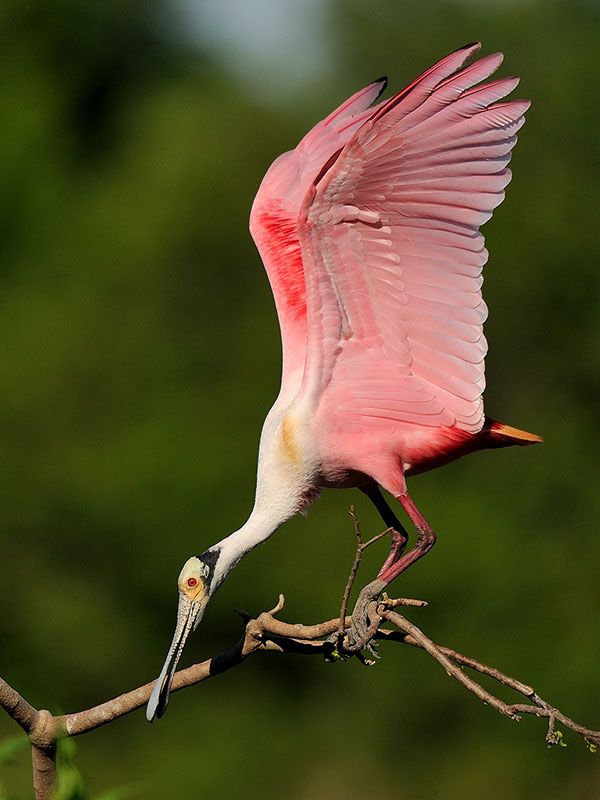
Where is `chest`? The image size is (600, 800). chest is located at coordinates (x=338, y=474).